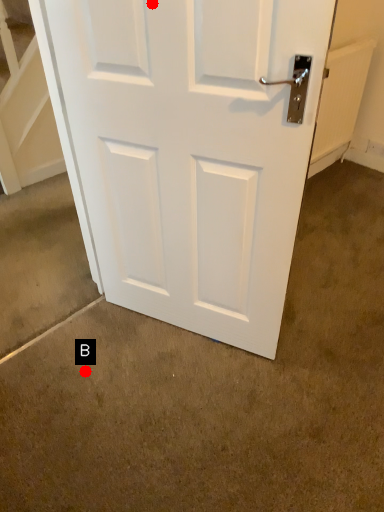
Question: Two points are circled on the image, labeled by A and B beside each circle. Among these points, which one is nearest to the camera?

Choices:
 (A) A is closer
 (B) B is closer

Answer: (A)